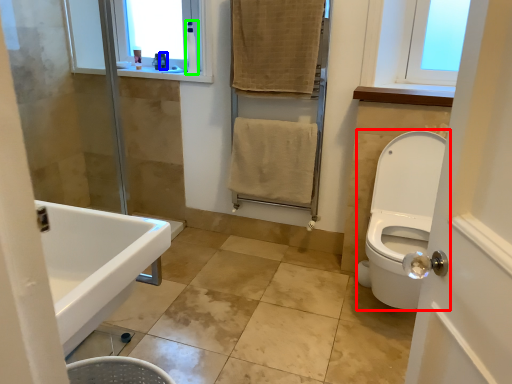
Question: Which object is positioned farthest from toilet (highlighted by a red box)? Select from toiletry (highlighted by a blue box) and toiletry (highlighted by a green box).

Choices:
 (A) toiletry
 (B) toiletry

Answer: (A)